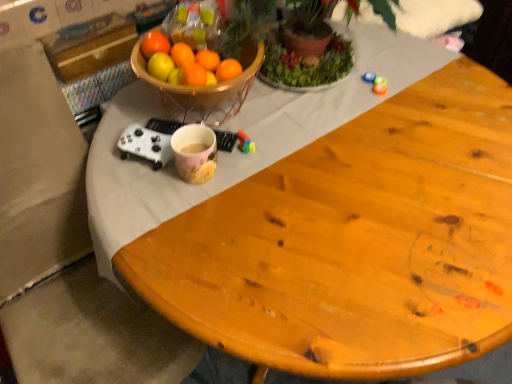
This screenshot has width=512, height=384. I want to click on pink ceramic mug at upper center, so click(203, 89).

What do you see at coordinates (203, 89) in the screenshot? This screenshot has width=512, height=384. I see `pink ceramic mug at upper center` at bounding box center [203, 89].

I want to click on pink ceramic mug at upper center, so click(x=203, y=89).